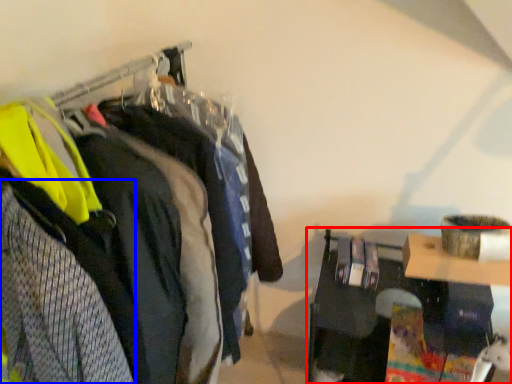
Question: Which of the following is the farthest to the observer, furniture (highlighted by a red box) or clothing (highlighted by a blue box)?

Choices:
 (A) furniture
 (B) clothing

Answer: (A)